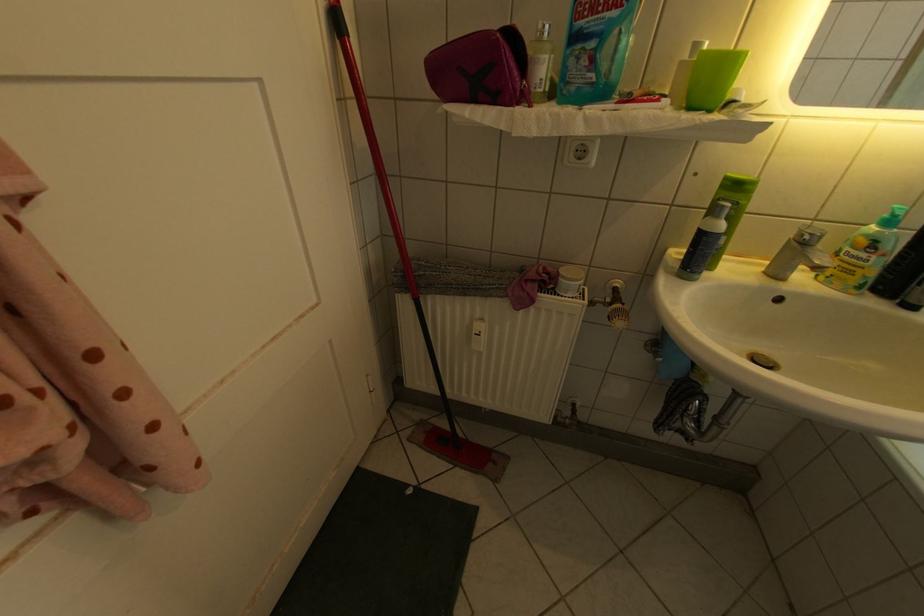
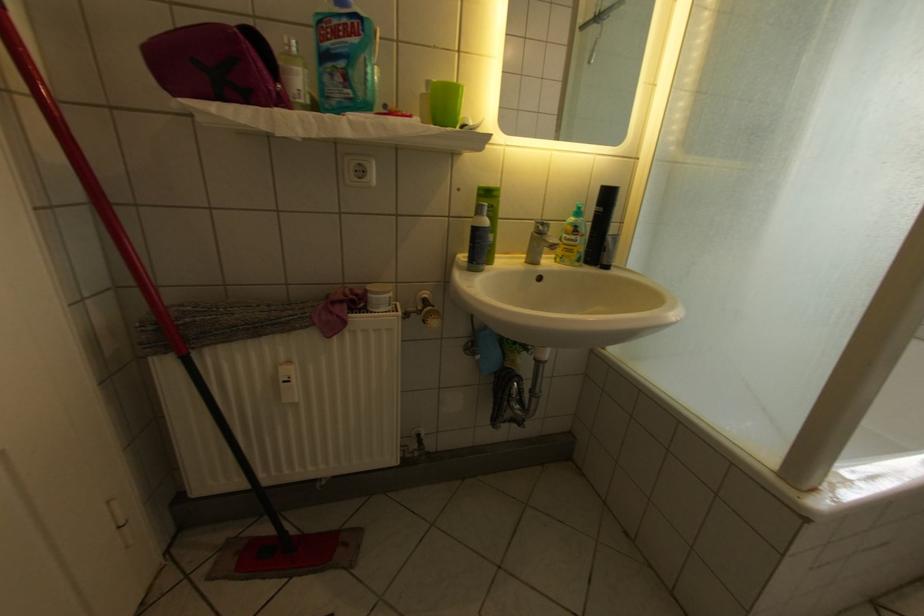
Locate, in the second image, the point that corresponds to point (604, 78) in the first image.

(360, 92)